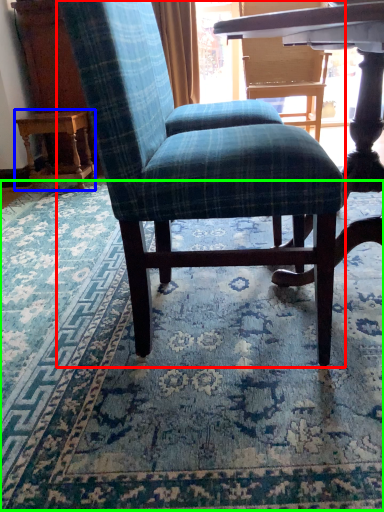
Question: Which object is positioned farthest from chair (highlighted by a red box)? Select from table (highlighted by a blue box) and mat (highlighted by a green box).

Choices:
 (A) table
 (B) mat

Answer: (A)